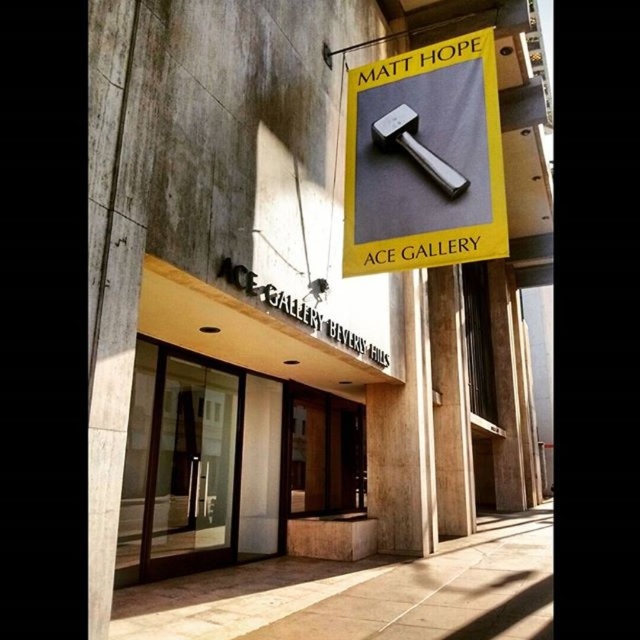
Question: Which of the following is the farthest from the observer?

Choices:
 (A) transparent glass door at center
 (B) polished silver hammer at center
 (C) metallic hammer at upper center

Answer: (A)

Question: Which point is farther from the camera taking this photo?

Choices:
 (A) (412, 150)
 (B) (381, 136)
 (C) (164, 355)

Answer: (C)

Question: Which point is closer to the camera taking this photo?

Choices:
 (A) (449, 193)
 (B) (195, 490)
 (C) (394, 140)

Answer: (A)

Question: Does metallic hammer at upper center have a lesser width compared to transparent glass door at center?

Choices:
 (A) yes
 (B) no

Answer: (B)

Question: Is metallic hammer at upper center wider than transparent glass door at center?

Choices:
 (A) yes
 (B) no

Answer: (A)

Question: Does transparent glass door at center come in front of polished silver hammer at center?

Choices:
 (A) no
 (B) yes

Answer: (A)